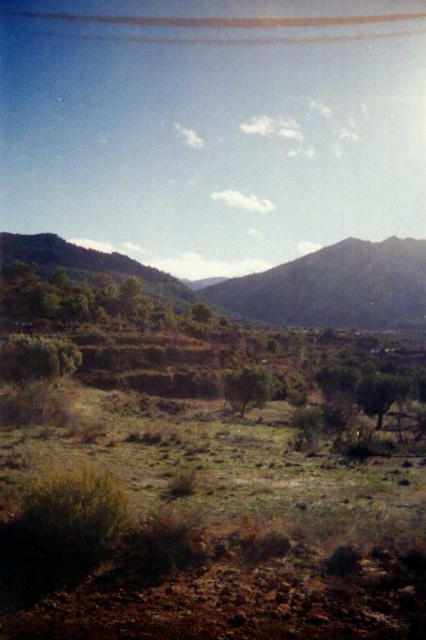
You are a landscape architect planning to plant a new tree in this rural area. The new tree requires a minimum of 50 feet of space between it and any existing trees to thrive. Given the current spacing between the green leafy tree at lower left and the green leafy tree at center, is this area suitable for planting the new tree according to the required spacing?

The green leafy tree at lower left and green leafy tree at center are 45.62 feet apart, which is less than the required 50 feet. Therefore, this area is not suitable for planting the new tree according to the required spacing.

You are standing at the point marked as point (376,320) in the image. A drone is flying above you at an altitude of 150 meters. Can the drone see the viewer from its current position?

The point marked as point (376,320) is 189.77 meters away from the viewer. Since the drone is flying at an altitude of 150 meters, which is lower than the distance between them, the drone cannot see the viewer from its current position.

You are standing at point (37,356) in the rural landscape. What object can you see directly in front of you?

You can see the green leafy tree at lower left directly in front of you at point (37,356).